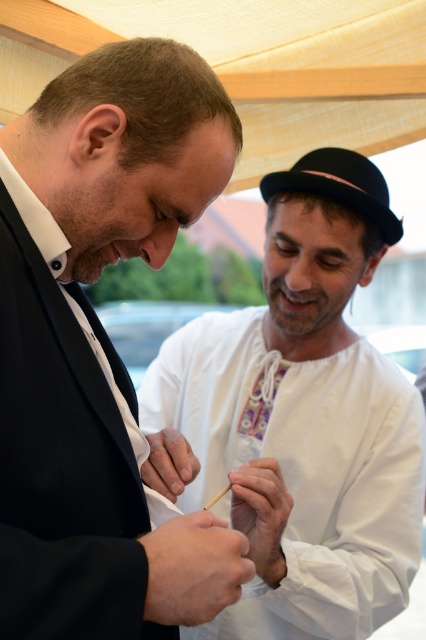
Question: Which of the following is the farthest from the observer?

Choices:
 (A) (158, 160)
 (B) (422, 445)
 (C) (276, 376)

Answer: (C)

Question: Which point appears closest to the camera in this image?

Choices:
 (A) (114, 496)
 (B) (241, 429)

Answer: (A)

Question: Can you confirm if black matte suit at center is wider than white embroidered shirt at center?

Choices:
 (A) yes
 (B) no

Answer: (B)

Question: Does black matte suit at center have a lesser width compared to white embroidered shirt at center?

Choices:
 (A) yes
 (B) no

Answer: (A)

Question: Which of the following is the farthest from the observer?

Choices:
 (A) (120, 170)
 (B) (275, 369)

Answer: (B)

Question: Can you confirm if black matte suit at center is positioned below embroidered fabric tie at center?

Choices:
 (A) no
 (B) yes

Answer: (A)